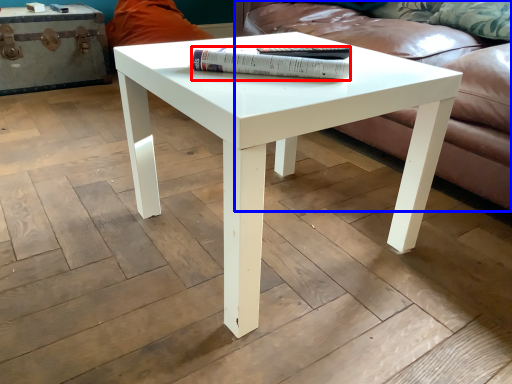
Question: Which of the following is the farthest to the observer, paperback book (highlighted by a red box) or studio couch (highlighted by a blue box)?

Choices:
 (A) paperback book
 (B) studio couch

Answer: (B)